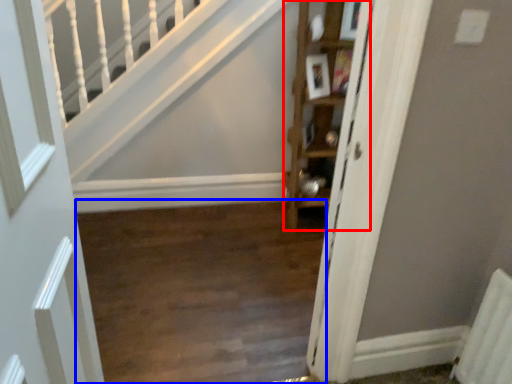
Question: Which point is closer to the camera, cabinet (highlighted by a red box) or corridor (highlighted by a blue box)?

Choices:
 (A) cabinet
 (B) corridor

Answer: (B)